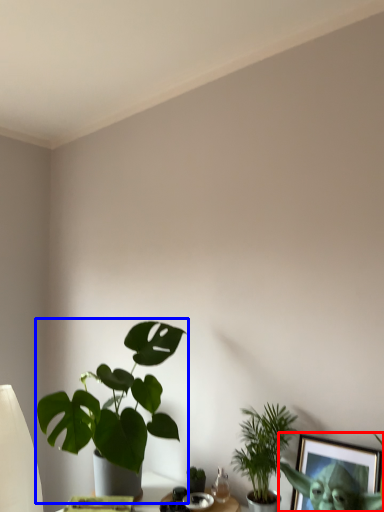
Question: Among these objects, which one is farthest to the camera, picture frame (highlighted by a red box) or houseplant (highlighted by a blue box)?

Choices:
 (A) picture frame
 (B) houseplant

Answer: (B)